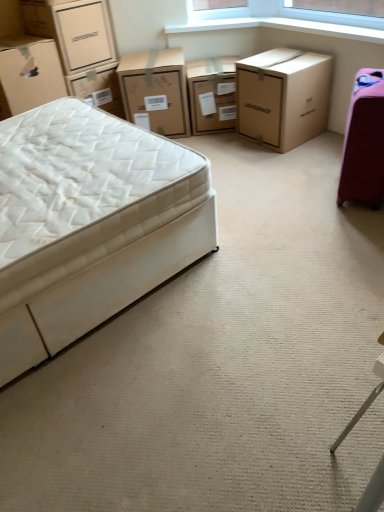
Find the location of a particular element. This screenshot has height=512, width=384. vacant space in front of white fabric bed at left is located at coordinates (140, 408).